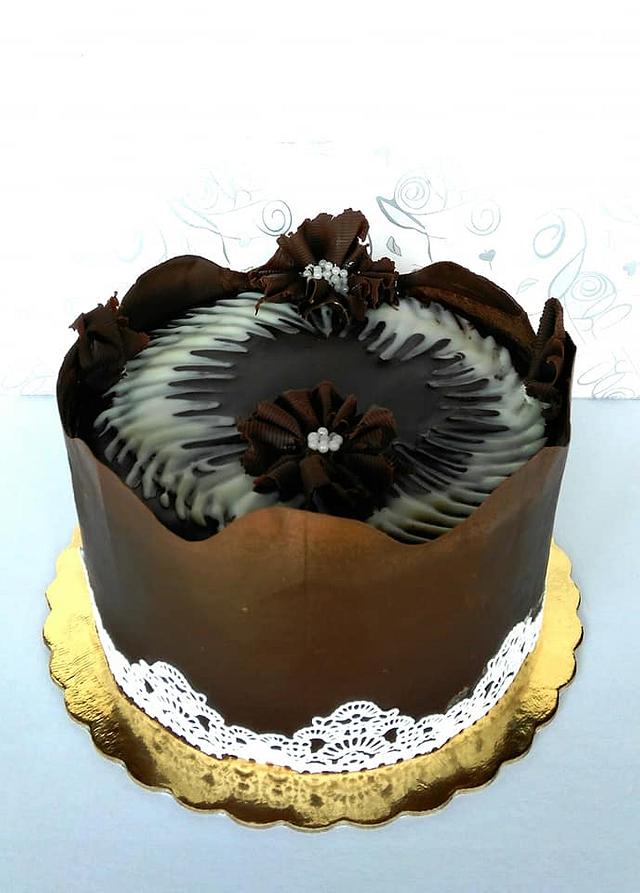
You are a GUI agent. You are given a task and a screenshot of the screen. Output one action in this format:
    pyautogui.click(x=<x>, y=<y>)
    Task: Click on the decorative petals
    Image resolution: width=640 pixels, height=893 pixels.
    Given the screenshot: What is the action you would take?
    pyautogui.click(x=404, y=219), pyautogui.click(x=262, y=221), pyautogui.click(x=186, y=219), pyautogui.click(x=492, y=253), pyautogui.click(x=396, y=248)